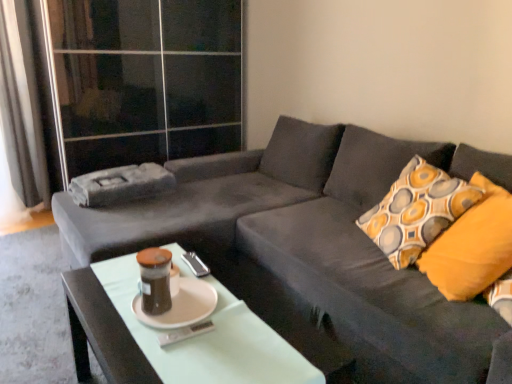
Question: In terms of width, does velvet dark gray couch at center look wider or thinner when compared to teal glass jar at center?

Choices:
 (A) wide
 (B) thin

Answer: (A)

Question: Does point (211, 157) appear closer or farther from the camera than point (150, 286)?

Choices:
 (A) closer
 (B) farther

Answer: (B)

Question: Considering the real-world distances, which object is closest to the white glossy coffee table at center?

Choices:
 (A) velvet dark gray couch at center
 (B) gray fabric curtain at left
 (C) transparent glass door at upper left
 (D) white matte saucer at center
 (E) patterned fabric pillow at right

Answer: (D)

Question: Estimate the real-world distances between objects in this image. Which object is closer to the velvet dark gray couch at center?

Choices:
 (A) patterned fabric pillow at right
 (B) transparent glass door at upper left
 (C) gray fabric curtain at left
 (D) white matte saucer at center
 (E) teal glass jar at center

Answer: (A)